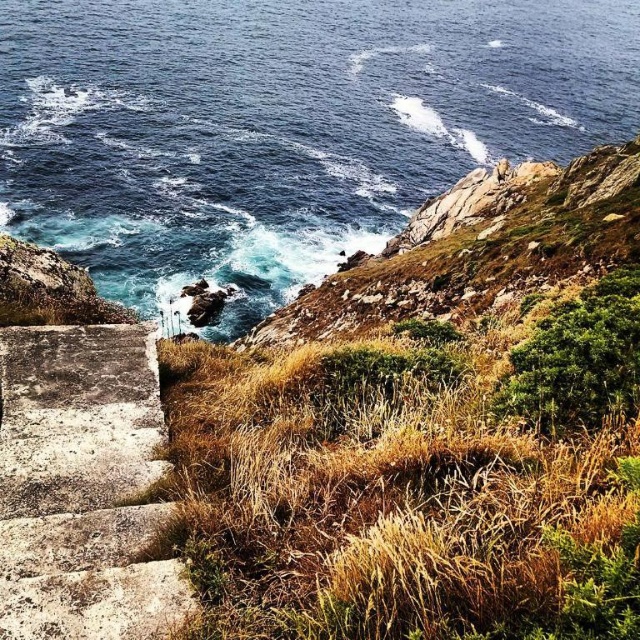
Looking at this image, you are standing at the top of the weathered concrete steps in the foreground of the coastal scene. You notice the blue water at upper left. Based on its position, can you determine if it is closer to you or farther away compared to the rocky coastline in the middle ground?

The blue water at upper left is located at point coordinates that place it farther away from the observer compared to the rocky coastline in the middle ground. Since the water is in the upper left and positioned at a higher coordinate, it is part of the distant background elements in the scene.

You are standing on the cliff overlooking the coast. You see the blue water at upper left and the concrete stairs at lower left. Which one appears bigger in the scene?

The blue water at upper left appears bigger in the scene because it has a larger size compared to the concrete stairs at lower left.